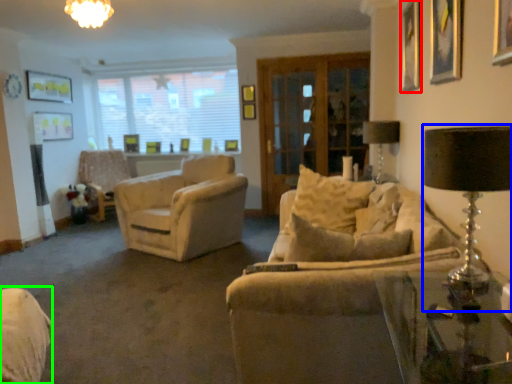
Question: Which is farther away from picture frame (highlighted by a red box)? table lamp (highlighted by a blue box) or swivel chair (highlighted by a green box)?

Choices:
 (A) table lamp
 (B) swivel chair

Answer: (B)